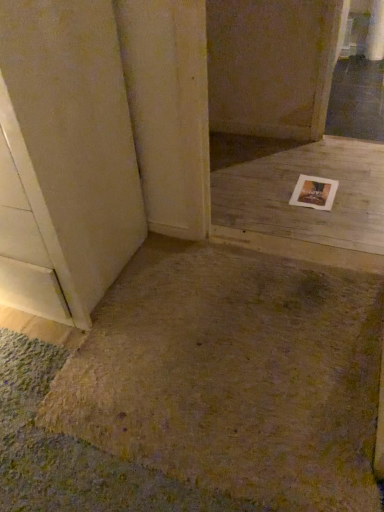
In order to face white paper at center, should I rotate leftwards or rightwards?

It's best to rotate right around 11.242 degrees.

Image resolution: width=384 pixels, height=512 pixels. What do you see at coordinates (294, 187) in the screenshot?
I see `white paper at center` at bounding box center [294, 187].

This screenshot has width=384, height=512. I want to click on white paper at center, so click(294, 187).

I want to click on white paper at center, so click(294, 187).